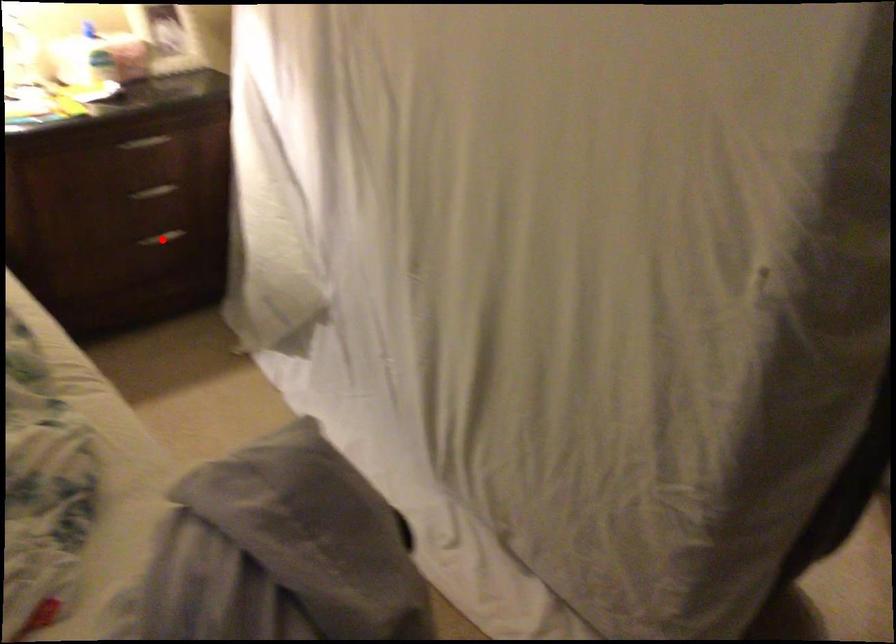
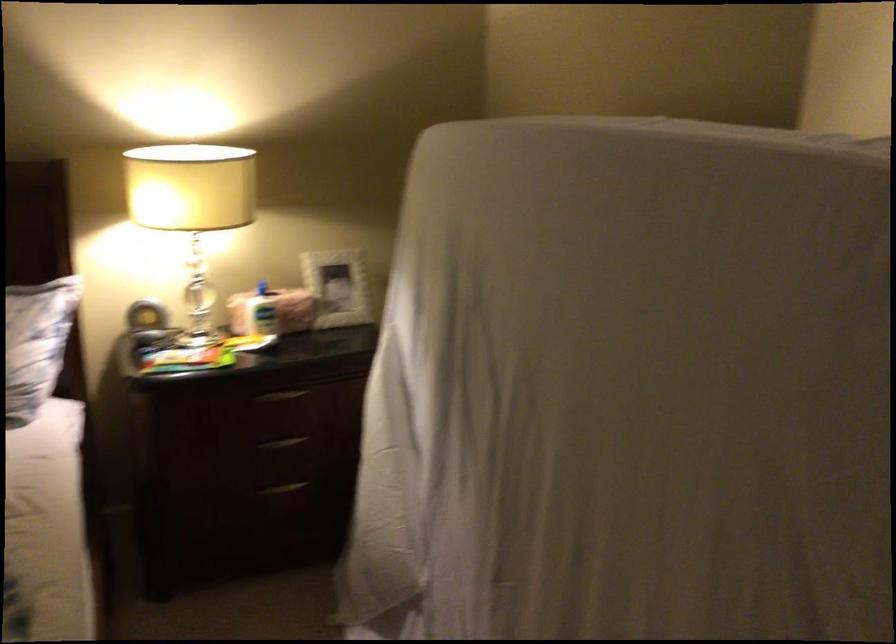
In the second image, find the point that corresponds to the highlighted location in the first image.

(283, 488)